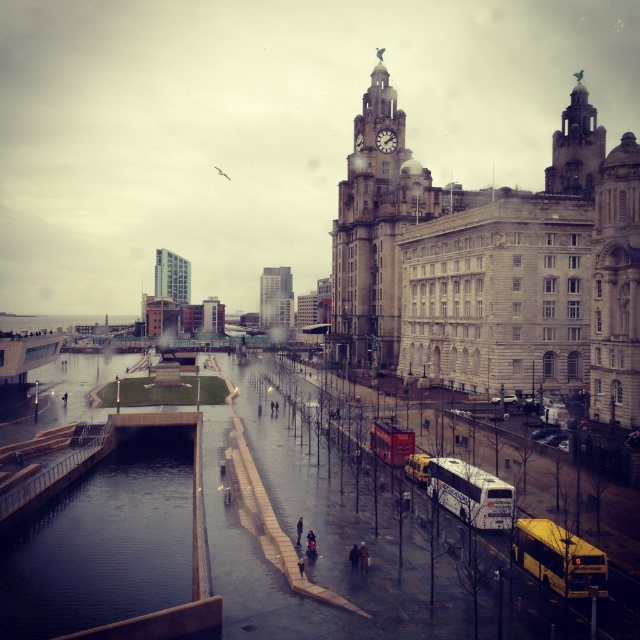
Question: Which is farther from the dark glassy water at lower left?

Choices:
 (A) white stone tower at center-right
 (B) stone clock tower at center
 (C) golden stone clock tower at upper right

Answer: (C)

Question: Is the position of dark glassy water at lower left less distant than that of golden stone clock tower at upper right?

Choices:
 (A) no
 (B) yes

Answer: (B)

Question: Where is dark glassy water at lower left located in relation to yellow metallic bus at lower right in the image?

Choices:
 (A) above
 (B) below

Answer: (B)

Question: Which point is closer to the camera?

Choices:
 (A) (435, 464)
 (B) (625, 294)

Answer: (A)

Question: Is stone clock tower at center below yellow metallic bus at lower right?

Choices:
 (A) no
 (B) yes

Answer: (A)

Question: Which point is closer to the camera?

Choices:
 (A) stone clock tower at center
 (B) yellow metallic bus at lower right
 (C) golden stone clock tower at upper right

Answer: (B)